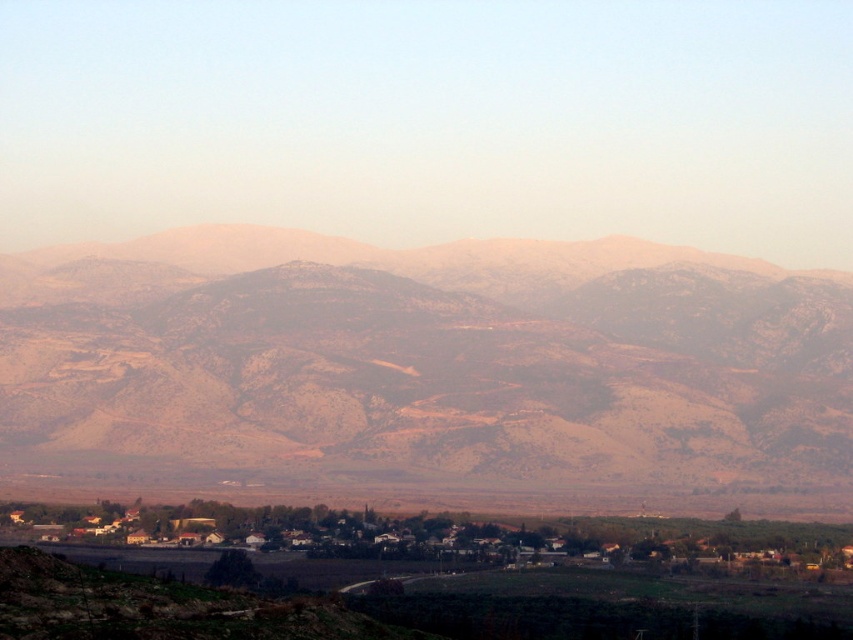
Does rustic brown mountains at center have a smaller size compared to brown wooden houses at center?

Actually, rustic brown mountains at center might be larger than brown wooden houses at center.

Which is more to the right, rustic brown mountains at center or brown wooden houses at center?

brown wooden houses at center is more to the right.

What do you see at coordinates (395, 371) in the screenshot? Image resolution: width=853 pixels, height=640 pixels. I see `rustic brown mountains at center` at bounding box center [395, 371].

Image resolution: width=853 pixels, height=640 pixels. Find the location of `rustic brown mountains at center`. rustic brown mountains at center is located at coordinates (395, 371).